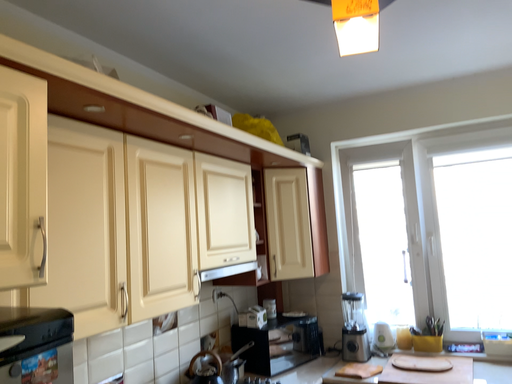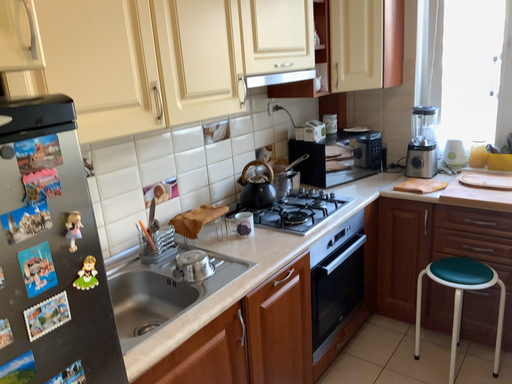
Question: Which way did the camera rotate in the video?

Choices:
 (A) rotated upward
 (B) rotated downward

Answer: (B)